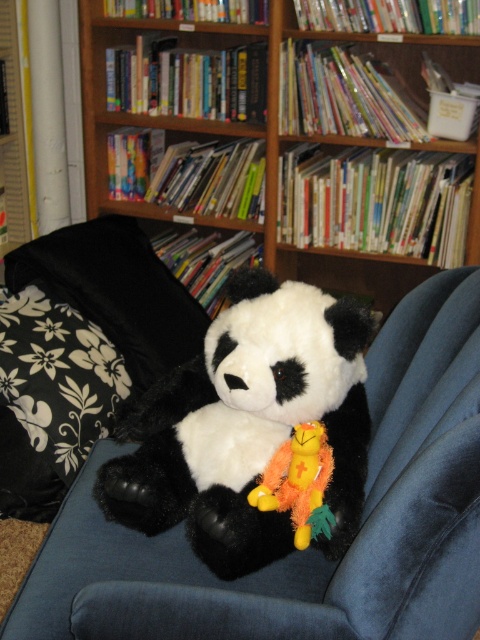
Who is positioned more to the left, wooden bookshelf at upper center or soft plush panda at center?

From the viewer's perspective, soft plush panda at center appears more on the left side.

Is point (346, 74) positioned behind point (260, 276)?

That is True.

Where is `wooden bookshelf at upper center`? This screenshot has width=480, height=640. wooden bookshelf at upper center is located at coordinates (283, 148).

Based on the photo, does wooden bookshelf at upper center appear on the right side of fluffy yellow plush at center?

Indeed, wooden bookshelf at upper center is positioned on the right side of fluffy yellow plush at center.

Between wooden bookshelf at upper center and fluffy yellow plush at center, which one is positioned higher?

wooden bookshelf at upper center is above.

In the scene shown: Measure the distance between wooden bookshelf at upper center and camera.

A distance of 2.05 meters exists between wooden bookshelf at upper center and camera.

At what (x,y) coordinates should I click in order to perform the action: click on wooden bookshelf at upper center. Please return your answer as a coordinate pair (x, y). The image size is (480, 640). Looking at the image, I should click on (283, 148).

Is the position of soft plush panda at center less distant than that of fluffy yellow plush at center?

Yes, it is in front of fluffy yellow plush at center.

How distant is soft plush panda at center from fluffy yellow plush at center?

5.29 inches

I want to click on soft plush panda at center, so click(245, 424).